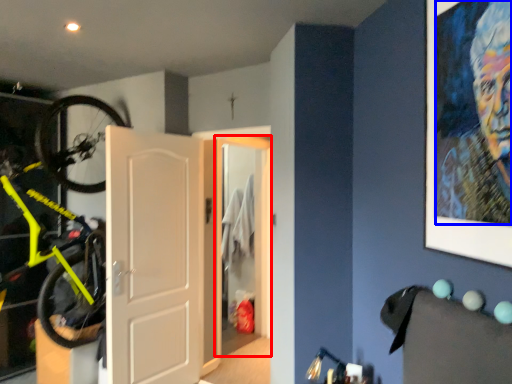
Question: Which object is further to the camera taking this photo, door (highlighted by a red box) or person (highlighted by a blue box)?

Choices:
 (A) door
 (B) person

Answer: (A)